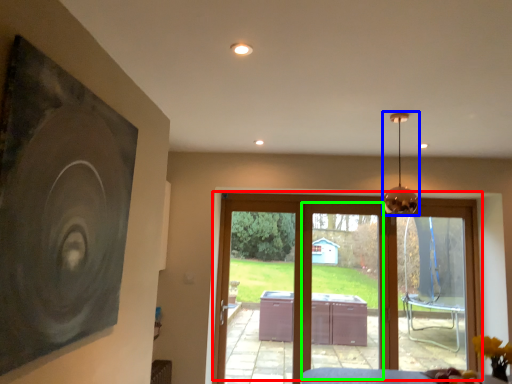
Question: Estimate the real-world distances between objects in this image. Which object is closer to door (highlighted by a red box), lamp (highlighted by a blue box) or screen door (highlighted by a green box)?

Choices:
 (A) lamp
 (B) screen door

Answer: (B)